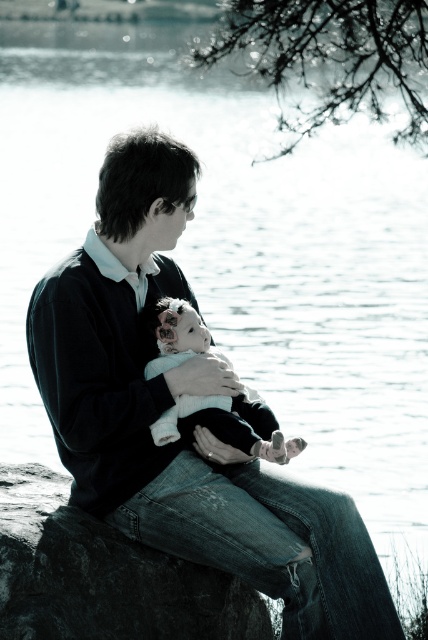
Looking at this image, does dark gray rock at lower left appear under fluffy white teddy bear at center?

Yes.

Is point (80, 630) farther from camera compared to point (198, 417)?

That is False.

Locate an element on the screen. This screenshot has height=640, width=428. dark gray rock at lower left is located at coordinates (104, 577).

Does dark blue jeans at center appear on the left side of dark gray rock at lower left?

No, dark blue jeans at center is not to the left of dark gray rock at lower left.

Who is shorter, dark blue jeans at center or dark gray rock at lower left?

With less height is dark gray rock at lower left.

Does point (77, 451) come behind point (165, 576)?

Yes, it is behind point (165, 576).

Locate an element on the screen. dark blue jeans at center is located at coordinates (169, 404).

From the picture: Does dark blue jeans at center have a lesser width compared to fluffy white teddy bear at center?

In fact, dark blue jeans at center might be wider than fluffy white teddy bear at center.

Is point (122, 220) more distant than point (165, 339)?

No.

Locate an element on the screen. dark blue jeans at center is located at coordinates (169, 404).